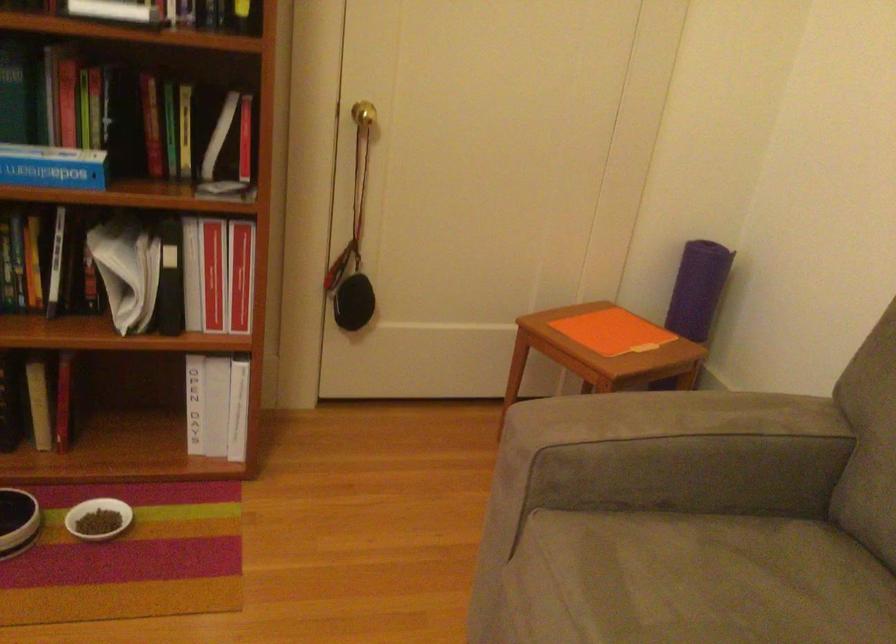
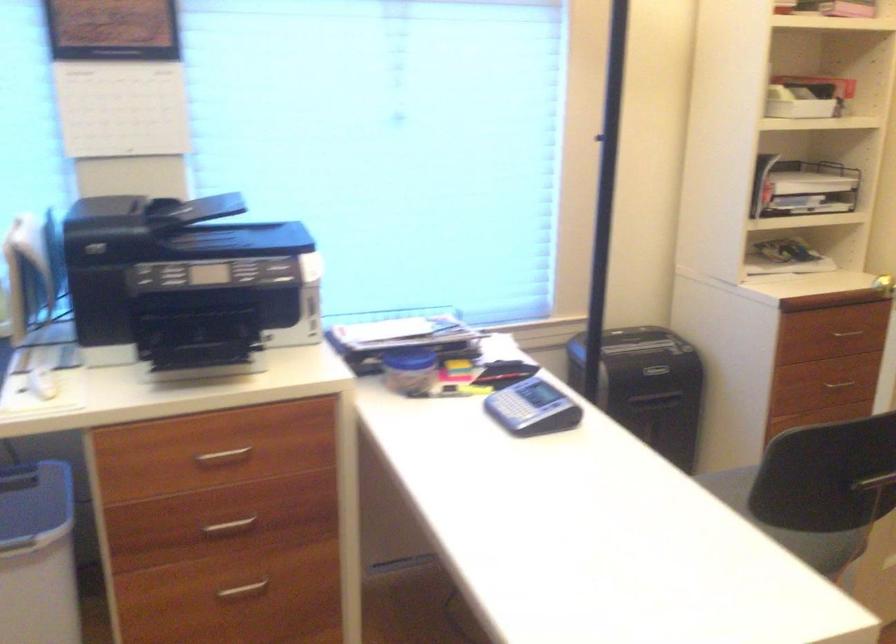
Question: The first image is from the beginning of the video and the second image is from the end. How did the camera likely rotate when shooting the video?

Choices:
 (A) Left
 (B) Right
 (C) Up
 (D) Down

Answer: (A)